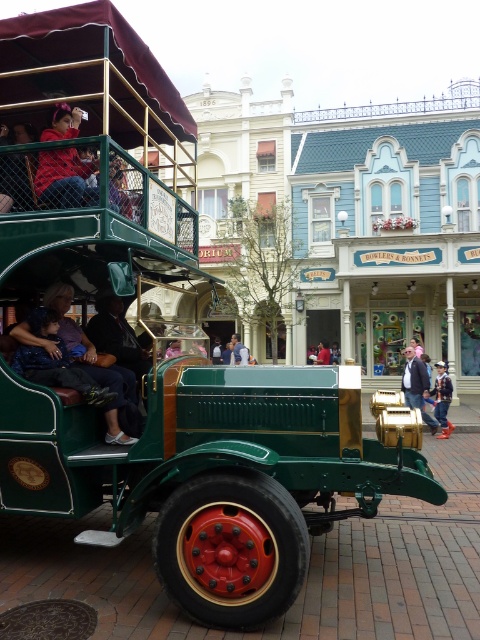
Question: Which object is the farthest from the matte green jacket at left?

Choices:
 (A) matte red jacket at upper left
 (B) denim jacket at center

Answer: (B)

Question: Which of the following is the farthest from the observer?

Choices:
 (A) (61, 124)
 (B) (324, 362)
 (C) (43, 346)

Answer: (B)

Question: Is matte green jacket at left to the right of denim jacket at center from the viewer's perspective?

Choices:
 (A) yes
 (B) no

Answer: (B)

Question: Which point appears farthest from the camera in this image?

Choices:
 (A) (325, 355)
 (B) (445, 381)

Answer: (A)

Question: Is the position of matte green jacket at left more distant than that of matte red jacket at upper left?

Choices:
 (A) no
 (B) yes

Answer: (B)

Question: Considering the relative positions of denim jacket at center and red shirt at center in the image provided, where is denim jacket at center located with respect to red shirt at center?

Choices:
 (A) right
 (B) left

Answer: (A)